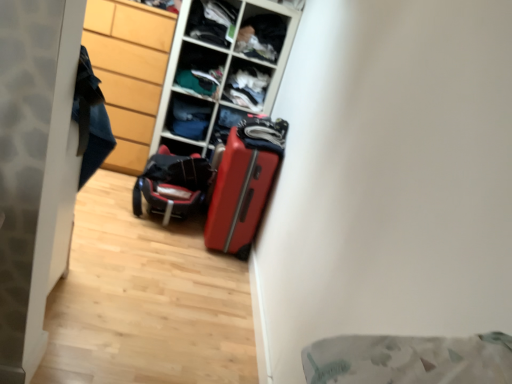
Question: From the image's perspective, relative to matte plastic shelf at upper center, the 5th shelf ordered from the bottom, is shiny red suitcase at center above or below?

Choices:
 (A) above
 (B) below

Answer: (B)

Question: From a real-world perspective, is shiny red suitcase at center positioned above or below matte plastic shelf at upper center, the 5th shelf ordered from the bottom?

Choices:
 (A) above
 (B) below

Answer: (B)

Question: Estimate the real-world distances between objects in this image. Which object is farther from the matte plastic shelf at upper center, which ranks as the third shelf in bottom-to-top order?

Choices:
 (A) matte plastic shelf at upper center, the 5th shelf ordered from the bottom
 (B) wooden textured shelf at center, which ranks as the fourth shelf in top-to-bottom order
 (C) wooden cabinet at left
 (D) black textured suitcase at center
 (E) dark fabric clothes at upper center, which ranks as the second shelf in top-to-bottom order

Answer: (D)

Question: Considering the real-world distances, which object is farthest from the wooden cabinet at left?

Choices:
 (A) black textured suitcase at center
 (B) wooden textured shelf at center, which ranks as the fourth shelf in top-to-bottom order
 (C) matte plastic cabinet at center
 (D) matte plastic shelf at upper center, which ranks as the third shelf in bottom-to-top order
 (E) matte plastic shelf at upper center, the 5th shelf ordered from the bottom

Answer: (C)